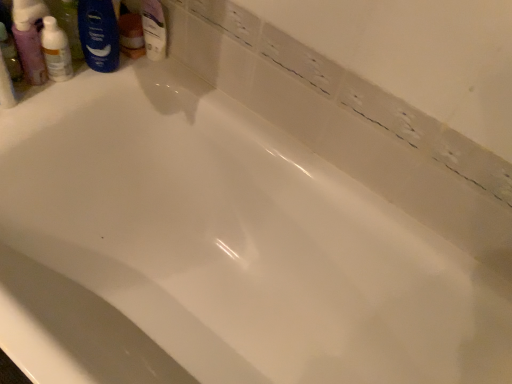
Where is `vacant area that lies in front of blue matte shaving cream at upper left`? This screenshot has height=384, width=512. vacant area that lies in front of blue matte shaving cream at upper left is located at coordinates (63, 90).